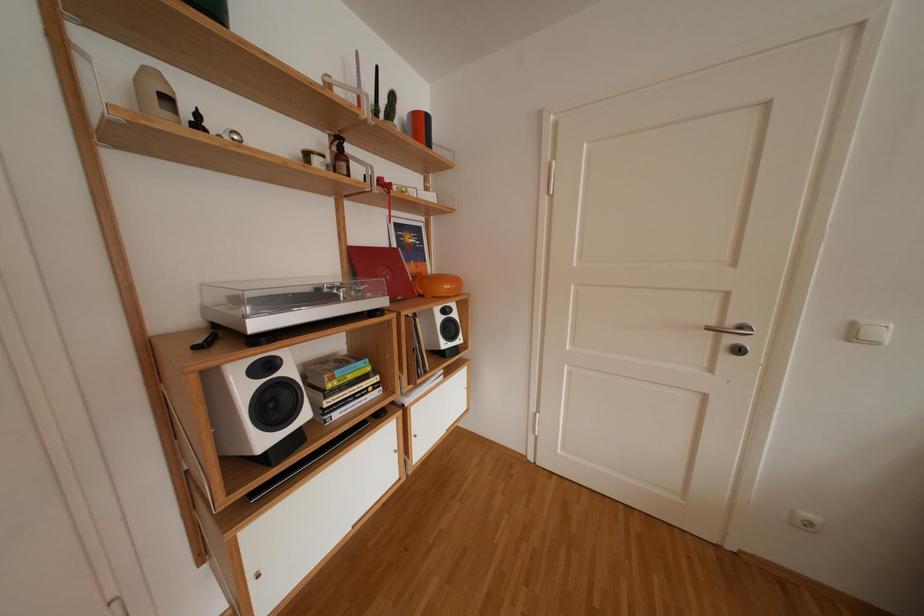
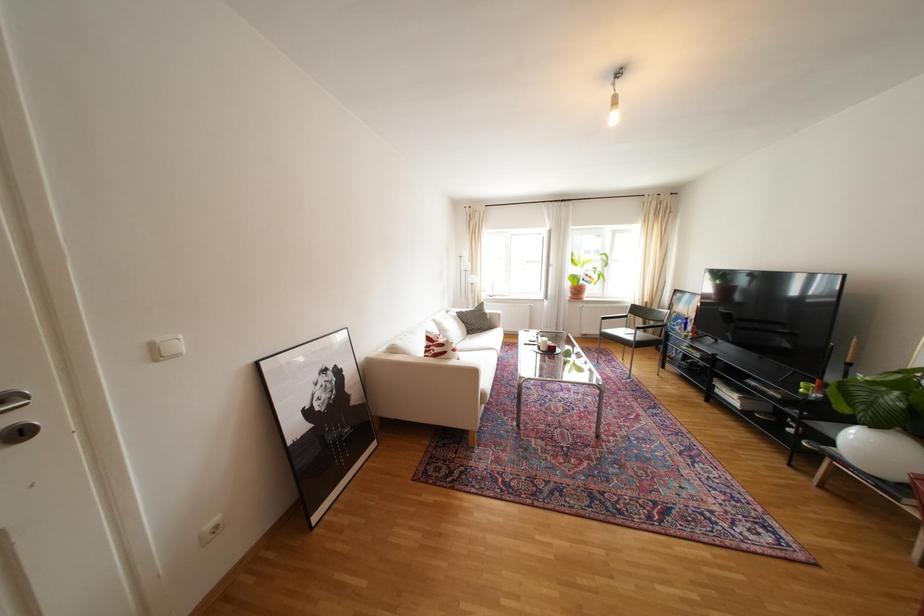
Question: The images are taken continuously from a first-person perspective. In which direction is your viewpoint rotating?

Choices:
 (A) Left
 (B) Right
 (C) Up
 (D) Down

Answer: (B)